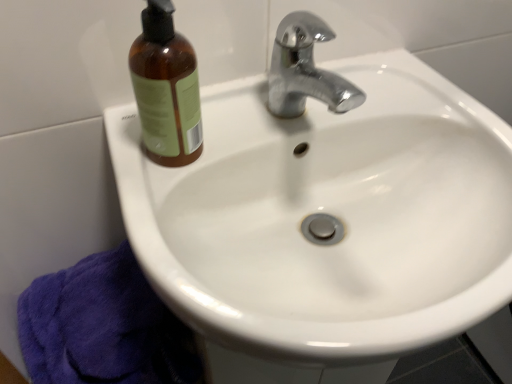
This screenshot has height=384, width=512. Describe the element at coordinates (103, 327) in the screenshot. I see `purple terry cloth towel at lower left` at that location.

Identify the location of purple terry cloth towel at lower left. (103, 327).

Where is `brown glass bottle at upper left`? brown glass bottle at upper left is located at coordinates (166, 88).

The image size is (512, 384). Describe the element at coordinates (166, 88) in the screenshot. I see `brown glass bottle at upper left` at that location.

What is the approximate height of brown glass bottle at upper left?

The height of brown glass bottle at upper left is 7.62 inches.

I want to click on purple terry cloth towel at lower left, so click(x=103, y=327).

Can you confirm if brown glass bottle at upper left is positioned to the left of purple terry cloth towel at lower left?

In fact, brown glass bottle at upper left is to the right of purple terry cloth towel at lower left.

Relative to purple terry cloth towel at lower left, is brown glass bottle at upper left in front or behind?

brown glass bottle at upper left is positioned closer to the viewer than purple terry cloth towel at lower left.

Is point (177, 98) behind point (42, 331)?

That is False.

From the image's perspective, is brown glass bottle at upper left located above purple terry cloth towel at lower left?

Yes.

From a real-world perspective, is brown glass bottle at upper left under purple terry cloth towel at lower left?

No, from a real-world perspective, brown glass bottle at upper left is not below purple terry cloth towel at lower left.

Considering the sizes of objects brown glass bottle at upper left and purple terry cloth towel at lower left in the image provided, who is thinner, brown glass bottle at upper left or purple terry cloth towel at lower left?

With smaller width is brown glass bottle at upper left.

Between brown glass bottle at upper left and purple terry cloth towel at lower left, which one has more height?

purple terry cloth towel at lower left is taller.

In terms of size, does brown glass bottle at upper left appear bigger or smaller than purple terry cloth towel at lower left?

In the image, brown glass bottle at upper left appears to be smaller than purple terry cloth towel at lower left.

Do you think brown glass bottle at upper left is within purple terry cloth towel at lower left, or outside of it?

brown glass bottle at upper left is spatially situated outside purple terry cloth towel at lower left.

In the scene shown: Can you see brown glass bottle at upper left touching purple terry cloth towel at lower left?

There is a gap between brown glass bottle at upper left and purple terry cloth towel at lower left.

Is brown glass bottle at upper left oriented towards purple terry cloth towel at lower left?

No, brown glass bottle at upper left does not turn towards purple terry cloth towel at lower left.

How different are the orientations of brown glass bottle at upper left and purple terry cloth towel at lower left in degrees?

0.338 degrees separate the facing orientations of brown glass bottle at upper left and purple terry cloth towel at lower left.

Looking at this image, measure the distance between brown glass bottle at upper left and purple terry cloth towel at lower left.

brown glass bottle at upper left is 11.98 inches from purple terry cloth towel at lower left.

At what (x,y) coordinates should I click in order to perform the action: click on bath towel behind the brown glass bottle at upper left. Please return your answer as a coordinate pair (x, y). The height and width of the screenshot is (384, 512). Looking at the image, I should click on (103, 327).

Considering the positions of objects purple terry cloth towel at lower left and brown glass bottle at upper left in the image provided, who is more to the left, purple terry cloth towel at lower left or brown glass bottle at upper left?

purple terry cloth towel at lower left is more to the left.

Relative to brown glass bottle at upper left, is purple terry cloth towel at lower left in front or behind?

purple terry cloth towel at lower left is behind brown glass bottle at upper left.

Which is nearer, (183, 378) or (154, 121)?

The point (154, 121) is closer to the camera.

From the image's perspective, is purple terry cloth towel at lower left over brown glass bottle at upper left?

No, from the image's perspective, purple terry cloth towel at lower left is not on top of brown glass bottle at upper left.

From a real-world perspective, is purple terry cloth towel at lower left located beneath brown glass bottle at upper left?

Yes, from a real-world perspective, purple terry cloth towel at lower left is beneath brown glass bottle at upper left.

Between purple terry cloth towel at lower left and brown glass bottle at upper left, which one has smaller width?

Thinner between the two is brown glass bottle at upper left.

In terms of height, does purple terry cloth towel at lower left look taller or shorter compared to brown glass bottle at upper left?

Clearly, purple terry cloth towel at lower left is taller compared to brown glass bottle at upper left.

Considering the sizes of purple terry cloth towel at lower left and brown glass bottle at upper left in the image, is purple terry cloth towel at lower left bigger or smaller than brown glass bottle at upper left?

Clearly, purple terry cloth towel at lower left is larger in size than brown glass bottle at upper left.

Based on the photo, which is correct: purple terry cloth towel at lower left is inside brown glass bottle at upper left, or outside of it?

purple terry cloth towel at lower left lies outside brown glass bottle at upper left.

Is purple terry cloth towel at lower left directly adjacent to brown glass bottle at upper left?

No, purple terry cloth towel at lower left is not touching brown glass bottle at upper left.

Could you tell me if purple terry cloth towel at lower left is turned towards brown glass bottle at upper left?

No.

Consider the image. How different are the orientations of purple terry cloth towel at lower left and brown glass bottle at upper left in degrees?

They differ by 0.338 degrees in their facing directions.

Image resolution: width=512 pixels, height=384 pixels. In order to click on bottle above the purple terry cloth towel at lower left (from the image's perspective) in this screenshot , I will do `click(166, 88)`.

This screenshot has width=512, height=384. What are the coordinates of `bottle above the purple terry cloth towel at lower left (from a real-world perspective)` in the screenshot? It's located at (166, 88).

Locate an element on the screen. Image resolution: width=512 pixels, height=384 pixels. bottle above the purple terry cloth towel at lower left (from the image's perspective) is located at coordinates (166, 88).